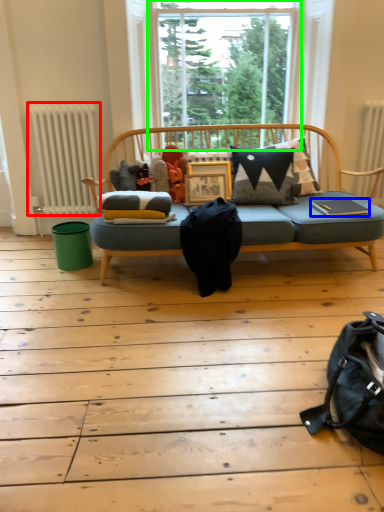
Question: Considering the real-world distances, which object is closest to radiator (highlighted by a red box)? book (highlighted by a blue box) or window (highlighted by a green box).

Choices:
 (A) book
 (B) window

Answer: (B)